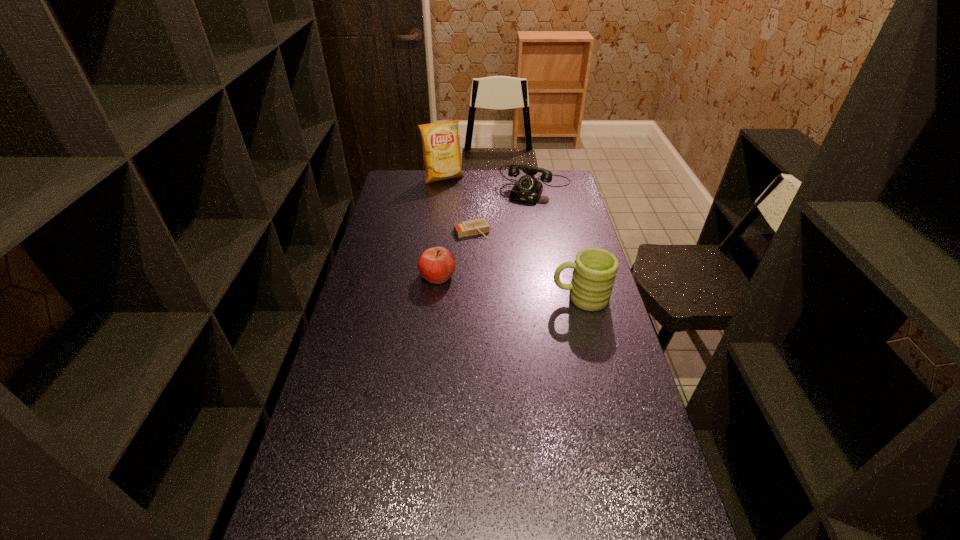
Find the location of a particular element. Image resolution: width=960 pixels, height=540 pixels. free space located 0.330m on the striking surface of the matchbox is located at coordinates (x=507, y=289).

This screenshot has height=540, width=960. In order to click on free space located 0.360m on the striking surface of the matchbox in this screenshot , I will do `click(510, 295)`.

Where is `vacant region located on the striking surface of the matchbox`? The image size is (960, 540). vacant region located on the striking surface of the matchbox is located at coordinates (487, 254).

Locate an element on the screen. This screenshot has width=960, height=540. vacant area situated on the front-facing side of the tallest object is located at coordinates (454, 192).

Identify the location of free space located on the front-facing side of the tallest object. (468, 213).

Locate an element on the screen. The width and height of the screenshot is (960, 540). free space located 0.260m on the front-facing side of the tallest object is located at coordinates (468, 212).

Find the location of a particular element. The width and height of the screenshot is (960, 540). vacant area situated on the front-facing side of the telephone is located at coordinates (500, 251).

Image resolution: width=960 pixels, height=540 pixels. I want to click on free location located 0.100m on the front-facing side of the telephone, so click(x=519, y=214).

Image resolution: width=960 pixels, height=540 pixels. In order to click on free region located 0.310m on the front-facing side of the telephone in this screenshot , I will do `click(506, 241)`.

Where is `crisp (potato chip) located in the far edge section of the desktop`? Image resolution: width=960 pixels, height=540 pixels. crisp (potato chip) located in the far edge section of the desktop is located at coordinates (441, 150).